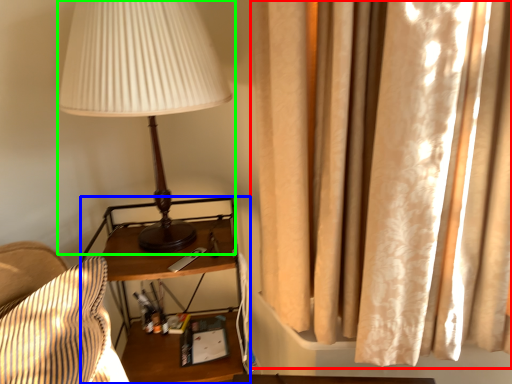
Question: Estimate the real-world distances between objects in this image. Which object is farther from curtain (highlighted by a red box), nightstand (highlighted by a blue box) or lamp (highlighted by a green box)?

Choices:
 (A) nightstand
 (B) lamp

Answer: (A)